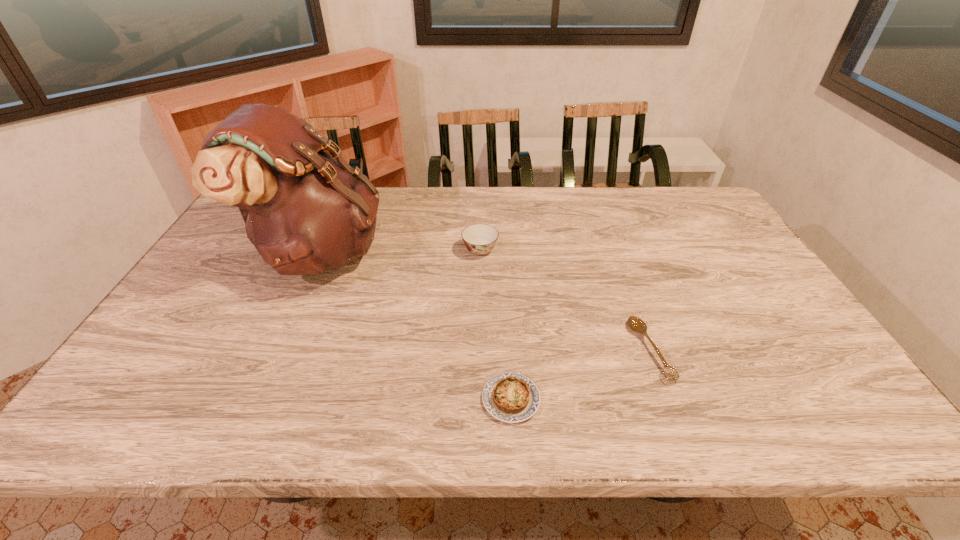
Find the location of a particular element. This screenshot has width=960, height=540. object that is at the near edge is located at coordinates (510, 397).

Where is `object at the left edge`? object at the left edge is located at coordinates (305, 211).

This screenshot has width=960, height=540. In order to click on object present at the far left corner in this screenshot , I will do `click(305, 211)`.

You are a GUI agent. You are given a task and a screenshot of the screen. Output one action in this format:
    pyautogui.click(x=<x>, y=<y>)
    Task: Click on the vacant position at the far edge of the desktop
    This screenshot has width=960, height=540.
    Given the screenshot: What is the action you would take?
    pyautogui.click(x=564, y=187)

The height and width of the screenshot is (540, 960). Identify the location of free space at the near edge. (606, 402).

Locate an element on the screen. blank area at the left edge is located at coordinates (245, 227).

Identify the location of free space at the right edge of the desktop. Image resolution: width=960 pixels, height=540 pixels. (720, 238).

Image resolution: width=960 pixels, height=540 pixels. What are the coordinates of `free space at the near left corner of the desktop` in the screenshot? It's located at (117, 422).

What are the coordinates of `unoccupied area between the leftmost object and the ladle` in the screenshot? It's located at (485, 301).

The width and height of the screenshot is (960, 540). Identify the location of free space between the ladle and the soup bowl. (564, 300).